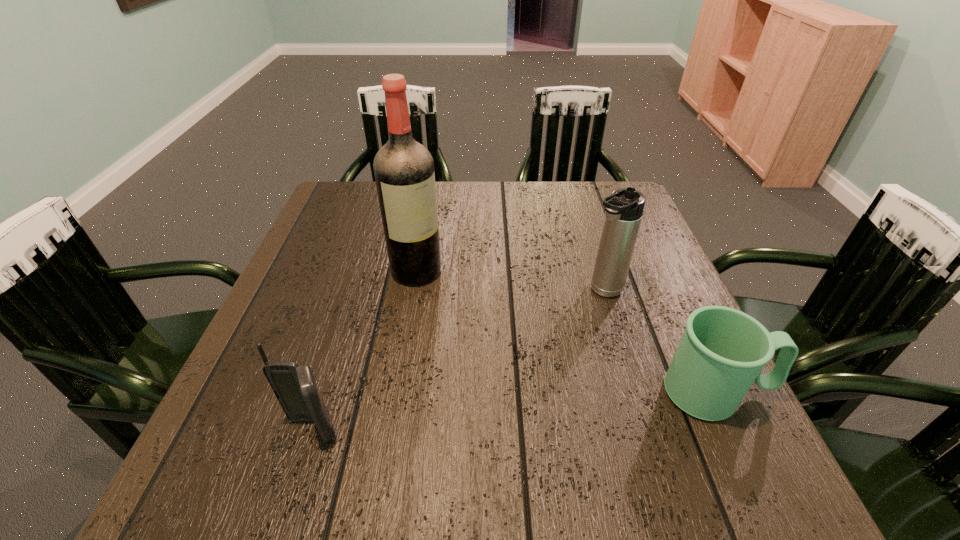
Find the location of a particular element. This screenshot has height=540, width=960. object present at the near right corner is located at coordinates (722, 352).

In the image, there is a desktop. Where is `free space at the near edge`? free space at the near edge is located at coordinates (396, 436).

This screenshot has height=540, width=960. In the image, there is a desktop. In order to click on vacant space at the left edge in this screenshot , I will do `click(317, 339)`.

This screenshot has width=960, height=540. I want to click on vacant space at the right edge of the desktop, so click(602, 226).

In the image, there is a desktop. Find the location of `blank space at the far right corner`. blank space at the far right corner is located at coordinates (589, 186).

Image resolution: width=960 pixels, height=540 pixels. In order to click on vacant space at the near right corner of the desktop in this screenshot , I will do `click(739, 426)`.

At what (x,y) coordinates should I click in order to perform the action: click on free space between the thermos bottle and the cellular telephone. Please return your answer as a coordinate pair (x, y). The image size is (960, 540). Looking at the image, I should click on (458, 361).

The width and height of the screenshot is (960, 540). Identify the location of free space between the mug and the third object from left to right. (660, 342).

Where is `vacant point located between the rightmost object and the cellular telephone`? The image size is (960, 540). vacant point located between the rightmost object and the cellular telephone is located at coordinates (515, 411).

Find the location of a particular element. The image size is (960, 540). vacant space that's between the third shortest object and the cellular telephone is located at coordinates (458, 361).